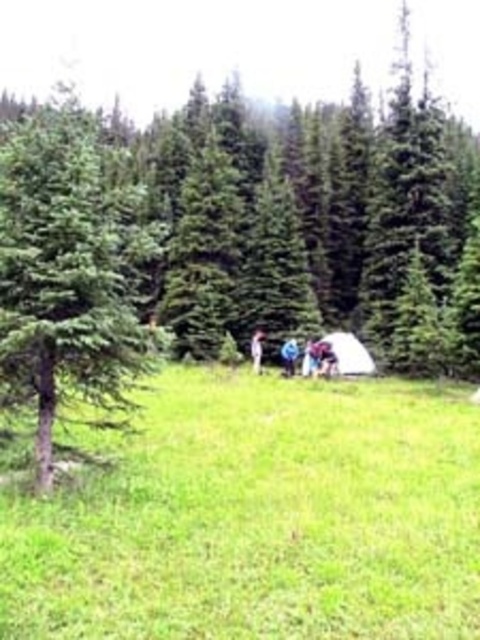
Is point (294, 364) farther from camera compared to point (254, 371)?

That is False.

This screenshot has height=640, width=480. Find the location of `blue fabric at center`. blue fabric at center is located at coordinates (289, 355).

Is point (294, 358) behind point (255, 364)?

No, (294, 358) is in front of (255, 364).

The height and width of the screenshot is (640, 480). Find the location of `blue fabric at center`. blue fabric at center is located at coordinates (289, 355).

Can you confirm if green needle-like tree at left is shorter than white fabric tent at center?

No, green needle-like tree at left is not shorter than white fabric tent at center.

Does green needle-like tree at left appear over white fabric tent at center?

Yes.

I want to click on green needle-like tree at left, so click(x=68, y=268).

Can you confirm if green needle-like tree at left is smaller than blue fabric at center?

No.

The image size is (480, 640). What do you see at coordinates (68, 268) in the screenshot? I see `green needle-like tree at left` at bounding box center [68, 268].

Find the location of a particular element. This screenshot has width=480, height=640. green needle-like tree at left is located at coordinates (68, 268).